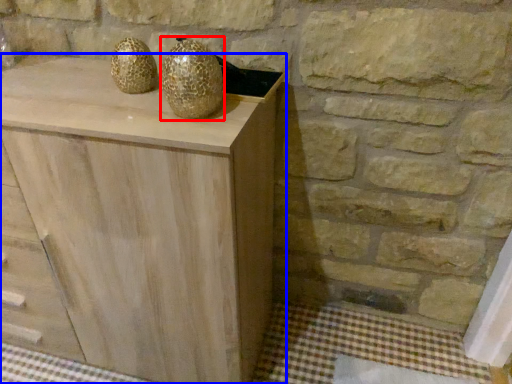
Question: Among these objects, which one is nearest to the camera, glass vase (highlighted by a red box) or chest of drawers (highlighted by a blue box)?

Choices:
 (A) glass vase
 (B) chest of drawers

Answer: (B)